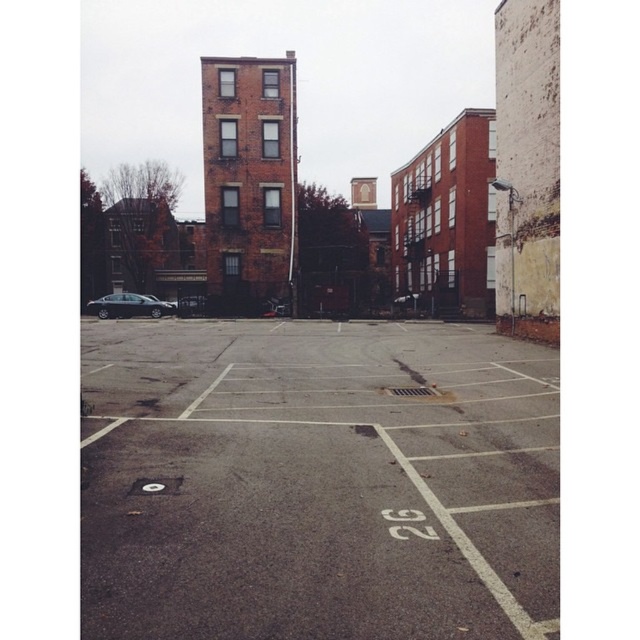
Question: Can you confirm if gray asphalt parking lot at center is smaller than shiny black sedan at left?

Choices:
 (A) yes
 (B) no

Answer: (A)

Question: Is gray asphalt parking lot at center bigger than shiny black sedan at left?

Choices:
 (A) no
 (B) yes

Answer: (A)

Question: In this image, where is gray asphalt parking lot at center located relative to shiny black sedan at left?

Choices:
 (A) above
 (B) below

Answer: (B)

Question: Which object appears closest to the camera in this image?

Choices:
 (A) shiny black sedan at left
 (B) gray asphalt parking lot at center

Answer: (B)